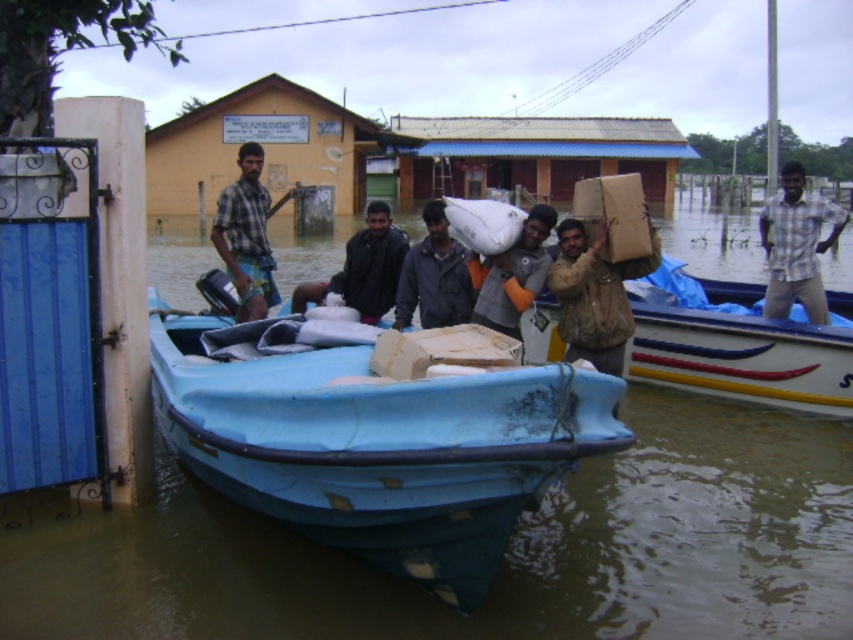
Does checkered fabric shirt at center have a larger size compared to matte gray jacket at center?

Indeed, checkered fabric shirt at center has a larger size compared to matte gray jacket at center.

Does checkered fabric shirt at center appear on the right side of matte gray jacket at center?

In fact, checkered fabric shirt at center is to the left of matte gray jacket at center.

What do you see at coordinates (247, 236) in the screenshot? I see `checkered fabric shirt at center` at bounding box center [247, 236].

You are a GUI agent. You are given a task and a screenshot of the screen. Output one action in this format:
    pyautogui.click(x=<x>, y=<y>)
    Task: Click on the checkered fabric shirt at center
    
    Given the screenshot: What is the action you would take?
    pyautogui.click(x=247, y=236)

Who is lower down, brown leather jacket at center or dark gray jacket at center?

Positioned lower is brown leather jacket at center.

Can you confirm if brown leather jacket at center is taller than dark gray jacket at center?

Yes, brown leather jacket at center is taller than dark gray jacket at center.

The width and height of the screenshot is (853, 640). What do you see at coordinates (595, 296) in the screenshot?
I see `brown leather jacket at center` at bounding box center [595, 296].

Locate an element on the screen. Image resolution: width=853 pixels, height=640 pixels. brown leather jacket at center is located at coordinates (595, 296).

What do you see at coordinates (595, 296) in the screenshot? I see `brown leather jacket at center` at bounding box center [595, 296].

I want to click on brown leather jacket at center, so click(595, 296).